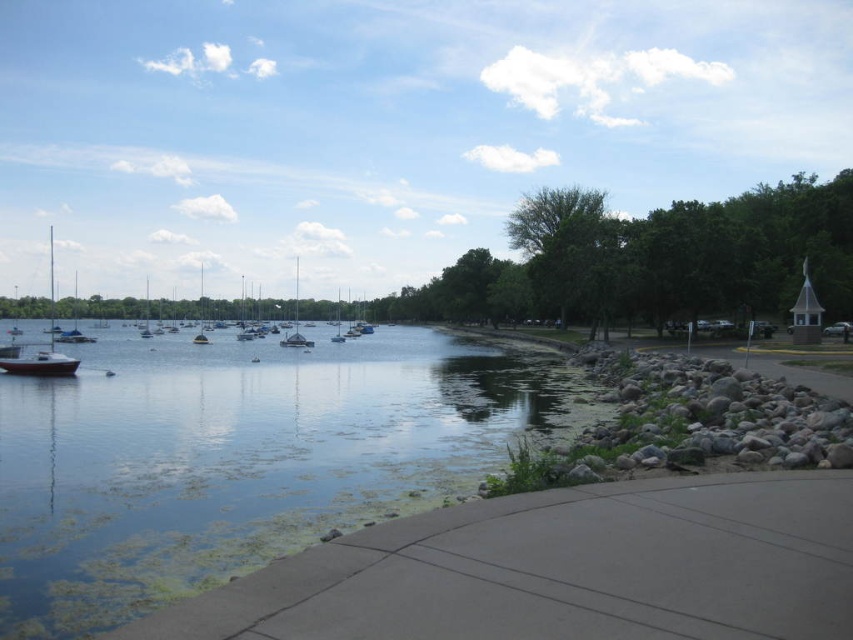
Question: Which of these objects is positioned closest to the green algae-covered water at center?

Choices:
 (A) white glossy sailboat at center
 (B) matte white sailboat at left
 (C) matte white boat at left

Answer: (C)

Question: Which of the following is the closest to the observer?

Choices:
 (A) (47, 365)
 (B) (404, 365)
 (C) (10, 365)
 (D) (283, 337)

Answer: (A)

Question: Considering the relative positions of green algae-covered water at center and white glossy sailboat at center in the image provided, where is green algae-covered water at center located with respect to white glossy sailboat at center?

Choices:
 (A) below
 (B) above

Answer: (A)

Question: Does matte white boat at left appear under white glossy sailboat at center?

Choices:
 (A) yes
 (B) no

Answer: (A)

Question: Is green algae-covered water at center smaller than matte white sailboat at left?

Choices:
 (A) no
 (B) yes

Answer: (B)

Question: Among these objects, which one is farthest from the camera?

Choices:
 (A) matte white sailboat at left
 (B) white glossy sailboat at center
 (C) green algae-covered water at center
 (D) matte white boat at left

Answer: (B)